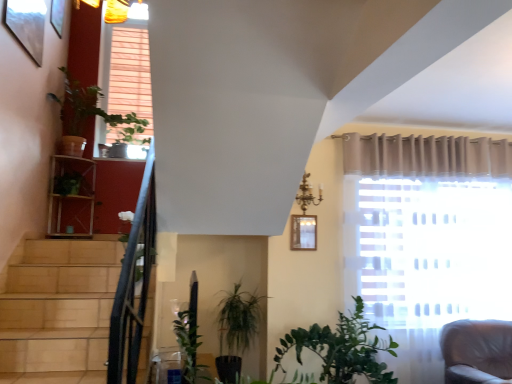
Question: Relative to green leafy plant at upper left, is wooden picture frame at upper center in front or behind?

Choices:
 (A) behind
 (B) front

Answer: (B)

Question: Is point (302, 235) positioned closer to the camera than point (124, 115)?

Choices:
 (A) farther
 (B) closer

Answer: (B)

Question: Considering the positions of wooden picture frame at upper center and green leafy plant at upper left in the image, is wooden picture frame at upper center taller or shorter than green leafy plant at upper left?

Choices:
 (A) short
 (B) tall

Answer: (A)

Question: Is green leafy plant at upper left in front of or behind wooden picture frame at upper center in the image?

Choices:
 (A) behind
 (B) front

Answer: (A)

Question: From a real-world perspective, is green leafy plant at upper left positioned above or below wooden picture frame at upper center?

Choices:
 (A) above
 (B) below

Answer: (A)

Question: From the image's perspective, is green leafy plant at upper left above or below wooden picture frame at upper center?

Choices:
 (A) above
 (B) below

Answer: (A)

Question: Looking at their shapes, would you say green leafy plant at upper left is wider or thinner than wooden picture frame at upper center?

Choices:
 (A) wide
 (B) thin

Answer: (A)